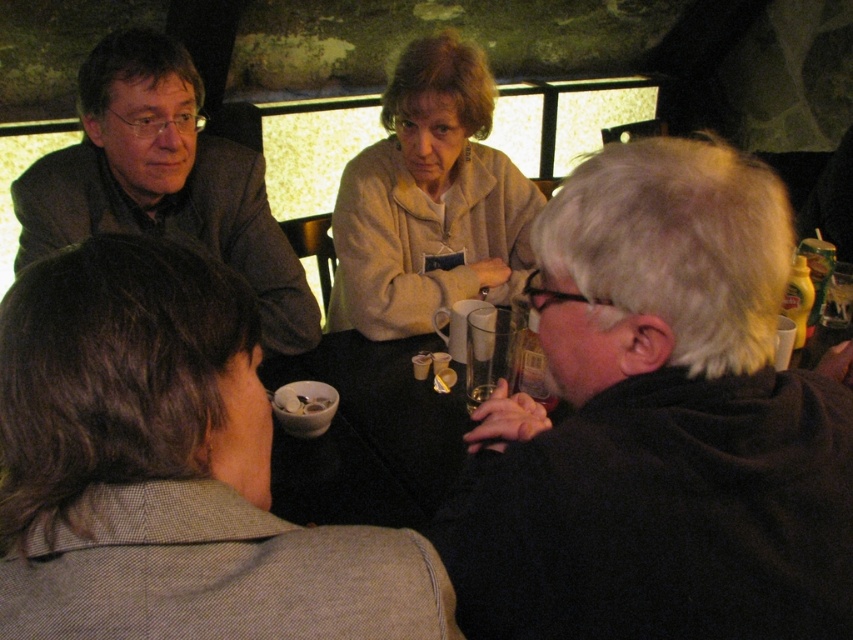
Question: Is dark gray sweater at right above gray woolen jacket at lower left?

Choices:
 (A) no
 (B) yes

Answer: (B)

Question: Which point is closer to the camera taking this photo?

Choices:
 (A) (672, 164)
 (B) (114, 147)
 (C) (463, 266)

Answer: (A)

Question: Among these points, which one is nearest to the camera?

Choices:
 (A) (234, 428)
 (B) (485, 102)

Answer: (A)

Question: Does light beige jacket at center appear under white matte bowl at center?

Choices:
 (A) yes
 (B) no

Answer: (B)

Question: Which of the following is the closest to the observer?

Choices:
 (A) gray woolen jacket at lower left
 (B) dark gray sweater at right

Answer: (A)

Question: Can you confirm if gray woolen jacket at lower left is bigger than light beige jacket at center?

Choices:
 (A) no
 (B) yes

Answer: (A)